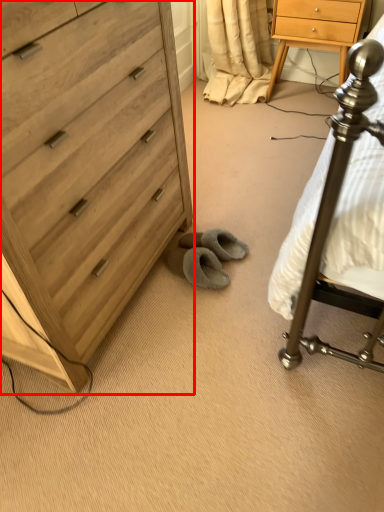
Question: Where is chest of drawers (annotated by the red box) located in relation to nightstand in the image?

Choices:
 (A) left
 (B) right

Answer: (A)